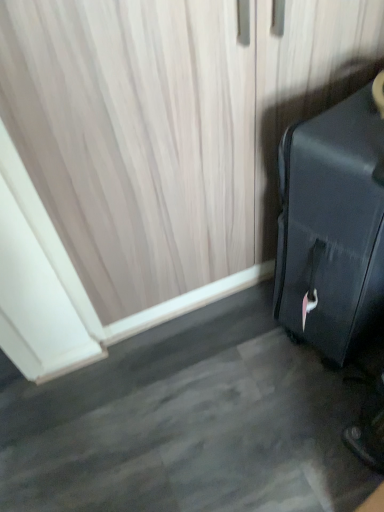
Question: Is black matte suitcase at right at the right side of matte beige curtain at upper left?

Choices:
 (A) yes
 (B) no

Answer: (A)

Question: From the image's perspective, is black matte suitcase at right located above matte beige curtain at upper left?

Choices:
 (A) no
 (B) yes

Answer: (A)

Question: Considering the relative positions of black matte suitcase at right and matte beige curtain at upper left in the image provided, is black matte suitcase at right to the left of matte beige curtain at upper left from the viewer's perspective?

Choices:
 (A) no
 (B) yes

Answer: (A)

Question: Can you confirm if black matte suitcase at right is wider than matte beige curtain at upper left?

Choices:
 (A) yes
 (B) no

Answer: (A)

Question: Can you see black matte suitcase at right touching matte beige curtain at upper left?

Choices:
 (A) yes
 (B) no

Answer: (B)

Question: Is black matte suitcase at right closer to camera compared to matte beige curtain at upper left?

Choices:
 (A) no
 (B) yes

Answer: (B)

Question: From a real-world perspective, does matte beige curtain at upper left stand above black matte suitcase at right?

Choices:
 (A) no
 (B) yes

Answer: (B)

Question: Does matte beige curtain at upper left have a lesser height compared to black matte suitcase at right?

Choices:
 (A) yes
 (B) no

Answer: (B)

Question: Is matte beige curtain at upper left further to the viewer compared to black matte suitcase at right?

Choices:
 (A) yes
 (B) no

Answer: (A)

Question: Does matte beige curtain at upper left have a greater width compared to black matte suitcase at right?

Choices:
 (A) yes
 (B) no

Answer: (B)

Question: Is matte beige curtain at upper left completely or partially outside of black matte suitcase at right?

Choices:
 (A) no
 (B) yes

Answer: (B)

Question: Is matte beige curtain at upper left thinner than black matte suitcase at right?

Choices:
 (A) no
 (B) yes

Answer: (B)

Question: Considering the relative positions of black matte suitcase at right and matte beige curtain at upper left in the image provided, is black matte suitcase at right to the left or to the right of matte beige curtain at upper left?

Choices:
 (A) right
 (B) left

Answer: (A)